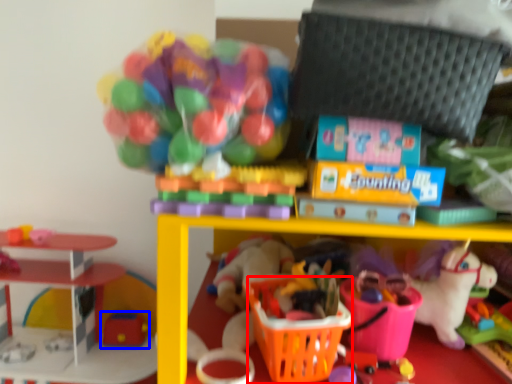
Question: Which object is further to the camera taking this photo, basket (highlighted by a red box) or toy (highlighted by a blue box)?

Choices:
 (A) basket
 (B) toy

Answer: (B)